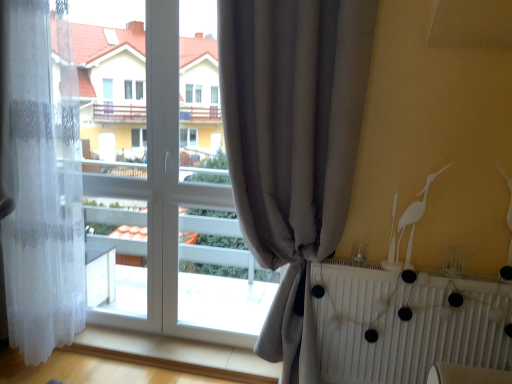
Question: Is gray fabric curtain at center, which ranks as the 1th curtain in right-to-left order, at the right side of white lace curtain at left, the 1th curtain viewed from the left?

Choices:
 (A) yes
 (B) no

Answer: (A)

Question: Is gray fabric curtain at center, marked as the second curtain in a left-to-right arrangement, directly adjacent to white lace curtain at left, arranged as the 2th curtain when viewed from the right?

Choices:
 (A) no
 (B) yes

Answer: (A)

Question: Considering the relative sizes of gray fabric curtain at center, marked as the second curtain in a left-to-right arrangement, and white lace curtain at left, the 1th curtain viewed from the left, in the image provided, is gray fabric curtain at center, marked as the second curtain in a left-to-right arrangement, taller than white lace curtain at left, the 1th curtain viewed from the left,?

Choices:
 (A) no
 (B) yes

Answer: (B)

Question: Is white lace curtain at left, arranged as the 2th curtain when viewed from the right, completely or partially inside gray fabric curtain at center, which ranks as the 1th curtain in right-to-left order?

Choices:
 (A) yes
 (B) no

Answer: (B)

Question: Does gray fabric curtain at center, marked as the second curtain in a left-to-right arrangement, turn towards white lace curtain at left, the 1th curtain viewed from the left?

Choices:
 (A) no
 (B) yes

Answer: (A)

Question: Would you say white matte radiator at lower right is to the left or to the right of gray fabric curtain at center, which ranks as the 1th curtain in right-to-left order, in the picture?

Choices:
 (A) left
 (B) right

Answer: (B)

Question: Relative to gray fabric curtain at center, marked as the second curtain in a left-to-right arrangement, is white matte radiator at lower right in front or behind?

Choices:
 (A) front
 (B) behind

Answer: (B)

Question: Looking at their shapes, would you say white matte radiator at lower right is wider or thinner than gray fabric curtain at center, marked as the second curtain in a left-to-right arrangement?

Choices:
 (A) wide
 (B) thin

Answer: (B)

Question: Is white matte radiator at lower right inside or outside of gray fabric curtain at center, marked as the second curtain in a left-to-right arrangement?

Choices:
 (A) outside
 (B) inside

Answer: (A)

Question: Considering the positions of white matte bird at upper right and white lace curtain at left, the 1th curtain viewed from the left, in the image, is white matte bird at upper right bigger or smaller than white lace curtain at left, the 1th curtain viewed from the left,?

Choices:
 (A) big
 (B) small

Answer: (B)

Question: Considering the positions of point (411, 248) and point (48, 147), is point (411, 248) closer or farther from the camera than point (48, 147)?

Choices:
 (A) closer
 (B) farther

Answer: (A)

Question: From the image's perspective, is white matte bird at upper right above or below white lace curtain at left, the 1th curtain viewed from the left?

Choices:
 (A) below
 (B) above

Answer: (A)

Question: In terms of width, does white matte bird at upper right look wider or thinner when compared to white lace curtain at left, the 1th curtain viewed from the left?

Choices:
 (A) thin
 (B) wide

Answer: (A)

Question: Do you think white lace curtain at left, arranged as the 2th curtain when viewed from the right, is within white matte radiator at lower right, or outside of it?

Choices:
 (A) outside
 (B) inside

Answer: (A)

Question: From the image's perspective, is white lace curtain at left, the 1th curtain viewed from the left, above or below white matte radiator at lower right?

Choices:
 (A) above
 (B) below

Answer: (A)